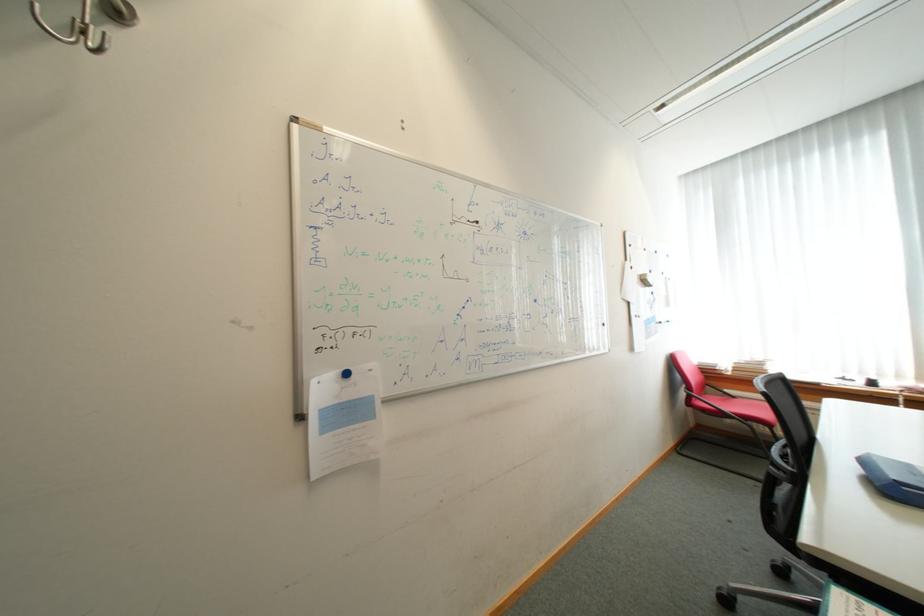
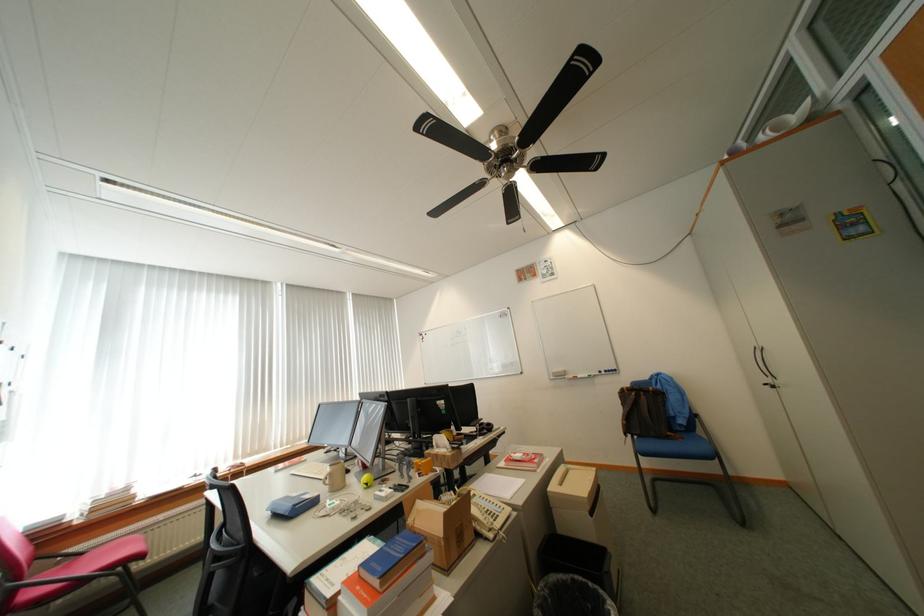
Locate, in the second image, the point that corresponds to (x=756, y=419) in the first image.

(123, 567)